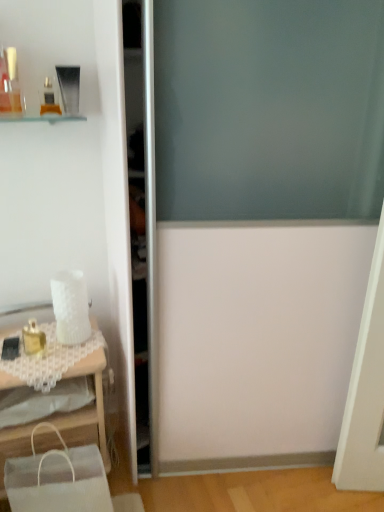
Question: From a real-world perspective, does matte gold compact at upper left, which ranks as the second toiletry in top-to-bottom order, stand above matte glass perfume bottle at upper left, the first toiletry from the top?

Choices:
 (A) no
 (B) yes

Answer: (A)

Question: Is matte gold compact at upper left, which ranks as the second toiletry in top-to-bottom order, shorter than matte glass perfume bottle at upper left, the 3th toiletry positioned from the bottom?

Choices:
 (A) no
 (B) yes

Answer: (B)

Question: Are matte gold compact at upper left, which ranks as the second toiletry in top-to-bottom order, and matte glass perfume bottle at upper left, the 3th toiletry positioned from the bottom, beside each other?

Choices:
 (A) no
 (B) yes

Answer: (A)

Question: Is matte gold compact at upper left, which ranks as the 2th toiletry in bottom-to-top order, wider than matte glass perfume bottle at upper left, the 3th toiletry positioned from the bottom?

Choices:
 (A) yes
 (B) no

Answer: (A)

Question: Does matte gold compact at upper left, which ranks as the second toiletry in top-to-bottom order, have a greater height compared to matte glass perfume bottle at upper left, the 3th toiletry positioned from the bottom?

Choices:
 (A) yes
 (B) no

Answer: (B)

Question: From a real-world perspective, is gold metallic perfume at left, marked as the third toiletry in a top-to-bottom arrangement, physically located above or below matte gold compact at upper left, which ranks as the second toiletry in top-to-bottom order?

Choices:
 (A) above
 (B) below

Answer: (B)

Question: Is gold metallic perfume at left, marked as the third toiletry in a top-to-bottom arrangement, taller or shorter than matte gold compact at upper left, which ranks as the 2th toiletry in bottom-to-top order?

Choices:
 (A) short
 (B) tall

Answer: (B)

Question: Relative to matte gold compact at upper left, which ranks as the 2th toiletry in bottom-to-top order, is gold metallic perfume at left, marked as the third toiletry in a top-to-bottom arrangement, in front or behind?

Choices:
 (A) behind
 (B) front

Answer: (A)

Question: Do you think gold metallic perfume at left, which is the first toiletry from bottom to top, is within matte gold compact at upper left, which ranks as the 2th toiletry in bottom-to-top order, or outside of it?

Choices:
 (A) inside
 (B) outside

Answer: (B)

Question: Considering their positions, is gold metallic perfume at left, marked as the third toiletry in a top-to-bottom arrangement, located in front of or behind white lace table at lower left?

Choices:
 (A) front
 (B) behind

Answer: (B)

Question: Is gold metallic perfume at left, marked as the third toiletry in a top-to-bottom arrangement, bigger or smaller than white lace table at lower left?

Choices:
 (A) big
 (B) small

Answer: (B)

Question: From a real-world perspective, relative to white lace table at lower left, is gold metallic perfume at left, which is the first toiletry from bottom to top, vertically above or below?

Choices:
 (A) below
 (B) above

Answer: (B)

Question: In terms of height, does gold metallic perfume at left, which is the first toiletry from bottom to top, look taller or shorter compared to white lace table at lower left?

Choices:
 (A) short
 (B) tall

Answer: (A)

Question: Does point (84, 488) appear closer or farther from the camera than point (13, 99)?

Choices:
 (A) closer
 (B) farther

Answer: (A)

Question: From a real-world perspective, is white fabric shopping bag at lower left positioned above or below matte glass perfume bottle at upper left, the first toiletry from the top?

Choices:
 (A) above
 (B) below

Answer: (B)